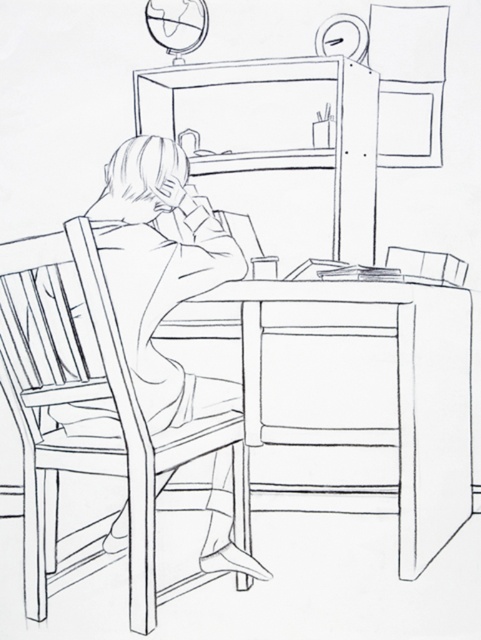
Question: Can you confirm if wooden chair at left is bigger than wooden chair at right?

Choices:
 (A) no
 (B) yes

Answer: (B)

Question: Which object is farther from the camera taking this photo?

Choices:
 (A) wooden table at center
 (B) wooden chair at right

Answer: (B)

Question: Which point is closer to the camera?

Choices:
 (A) pyautogui.click(x=435, y=266)
 (B) pyautogui.click(x=230, y=291)
 (C) pyautogui.click(x=101, y=554)

Answer: (B)

Question: Can you confirm if wooden chair at left is thinner than wooden chair at right?

Choices:
 (A) no
 (B) yes

Answer: (A)

Question: Which of the following is the closest to the observer?

Choices:
 (A) (65, 426)
 (B) (432, 260)
 (C) (334, 493)

Answer: (A)

Question: From the image, what is the correct spatial relationship of wooden table at center in relation to wooden chair at left?

Choices:
 (A) left
 (B) right

Answer: (B)